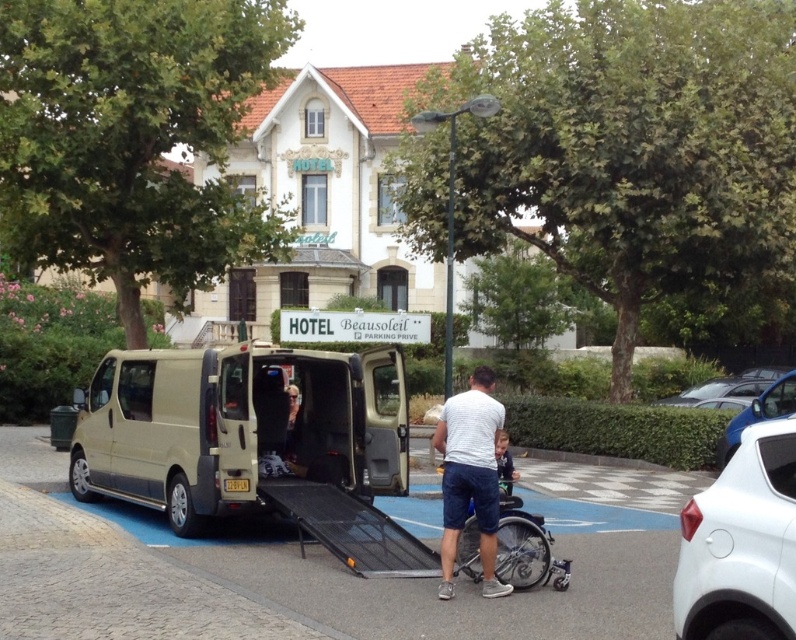
Question: Is beige metallic van at center closer to camera compared to white striped shirt at center?

Choices:
 (A) yes
 (B) no

Answer: (B)

Question: Which point is farther from the camera taking this photo?

Choices:
 (A) (145, 451)
 (B) (516, 476)
 (C) (716, 380)
 (D) (521, 576)

Answer: (C)

Question: Considering the real-world distances, which object is farthest from the beige metallic van at center?

Choices:
 (A) white glossy car at right
 (B) silver metallic wheelchair at lower center
 (C) white striped shirt at center

Answer: (A)

Question: Does beige metallic van at center come in front of white glossy car at right?

Choices:
 (A) no
 (B) yes

Answer: (B)

Question: Can you confirm if beige metallic van at center is smaller than metallic blue sedan at center right?

Choices:
 (A) yes
 (B) no

Answer: (B)

Question: Which of the following is the farthest from the observer?

Choices:
 (A) (791, 412)
 (B) (114, 362)

Answer: (A)